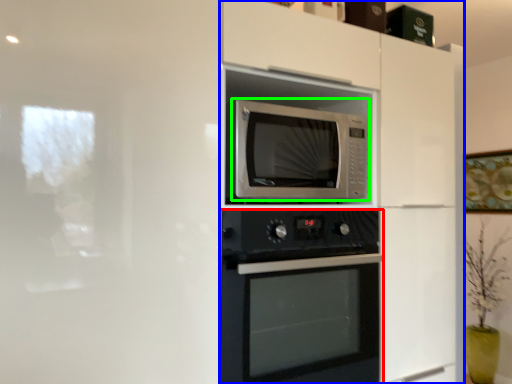
Question: Based on their relative distances, which object is farther from oven (highlighted by a red box)? Choose from dresser (highlighted by a blue box) and microwave oven (highlighted by a green box).

Choices:
 (A) dresser
 (B) microwave oven

Answer: (A)